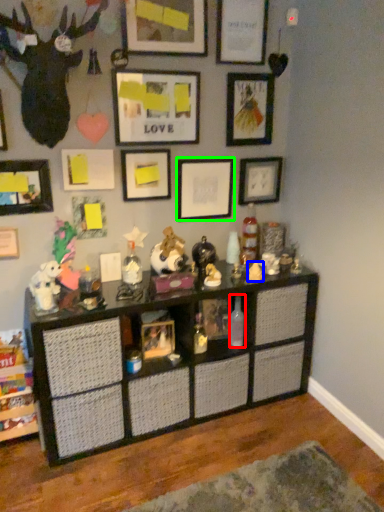
Question: Based on their relative distances, which object is nearer to bottle (highlighted by a red box)? Choose from toy (highlighted by a blue box) and picture frame (highlighted by a green box).

Choices:
 (A) toy
 (B) picture frame

Answer: (A)